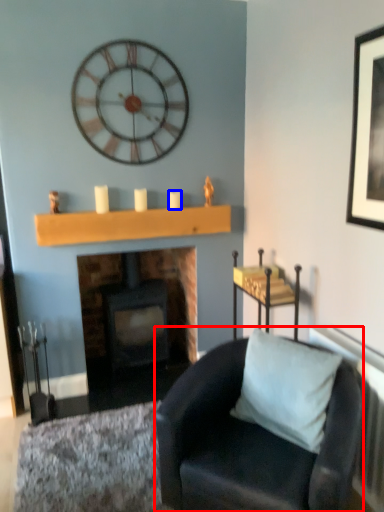
Question: Which object appears farthest to the camera in this image, chair (highlighted by a red box) or candle (highlighted by a blue box)?

Choices:
 (A) chair
 (B) candle

Answer: (B)